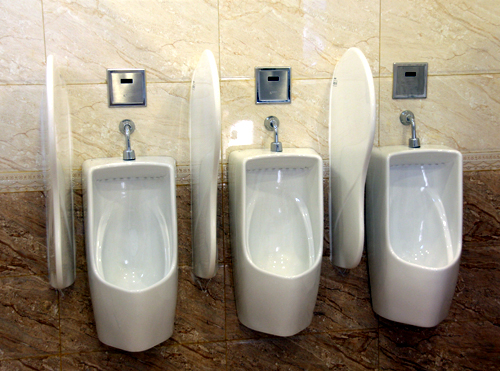
I want to click on brick wall, so point(469,110), point(461,36), point(324,27), point(167,40), point(22,40), point(8,143), point(88,119), point(235,112).